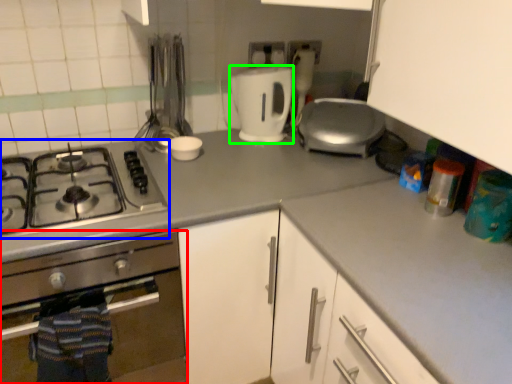
Question: Based on their relative distances, which object is farther from kitchen appliance (highlighted by a red box)? Choose from gas stove (highlighted by a blue box) and kitchen appliance (highlighted by a green box).

Choices:
 (A) gas stove
 (B) kitchen appliance

Answer: (B)